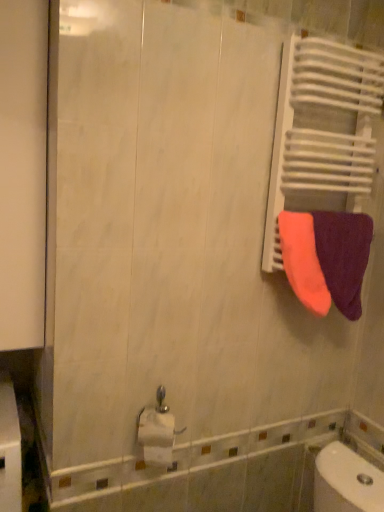
This screenshot has height=512, width=384. Identify the location of orange terry cloth towel at right, which ranks as the 1th towel in right-to-left order. pyautogui.click(x=343, y=256).

From the picture: Measure the distance between point (354, 218) and camera.

They are 4.88 feet apart.

Find the location of a particular element. white glossy toilet paper at lower center is located at coordinates (156, 435).

Looking at this image, is white glossy toilet paper at lower center touching neon orange fabric at right, which is the 1th towel in left-to-right order?

No.

Visually, is white glossy toilet paper at lower center positioned to the left or to the right of neon orange fabric at right, which is the 1th towel in left-to-right order?

From the image, it's evident that white glossy toilet paper at lower center is to the left of neon orange fabric at right, which is the 1th towel in left-to-right order.

Looking at this image, in terms of size, does white glossy toilet paper at lower center appear bigger or smaller than neon orange fabric at right, positioned as the second towel in right-to-left order?

Clearly, white glossy toilet paper at lower center is smaller in size than neon orange fabric at right, positioned as the second towel in right-to-left order.

Does neon orange fabric at right, which is the 1th towel in left-to-right order, have a smaller size compared to white glossy toilet paper at lower center?

No.

From the image's perspective, does neon orange fabric at right, positioned as the second towel in right-to-left order, appear lower than white glossy toilet paper at lower center?

No.

Could you measure the distance between neon orange fabric at right, positioned as the second towel in right-to-left order, and white glossy toilet paper at lower center?

They are 68.12 centimeters apart.

Considering the positions of objects neon orange fabric at right, positioned as the second towel in right-to-left order, and white glossy toilet paper at lower center in the image provided, who is more to the right, neon orange fabric at right, positioned as the second towel in right-to-left order, or white glossy toilet paper at lower center?

neon orange fabric at right, positioned as the second towel in right-to-left order, is more to the right.

Is white glossy toilet paper at lower center positioned beyond the bounds of orange terry cloth towel at right, which ranks as the 2th towel in left-to-right order?

white glossy toilet paper at lower center lies outside orange terry cloth towel at right, which ranks as the 2th towel in left-to-right order,'s area.

From the image's perspective, between white glossy toilet paper at lower center and orange terry cloth towel at right, which ranks as the 1th towel in right-to-left order, who is located below?

white glossy toilet paper at lower center is shown below in the image.

Can you confirm if white glossy toilet paper at lower center is positioned to the right of orange terry cloth towel at right, which ranks as the 2th towel in left-to-right order?

No.

Can you confirm if orange terry cloth towel at right, which ranks as the 1th towel in right-to-left order, is positioned to the left of neon orange fabric at right, positioned as the second towel in right-to-left order?

In fact, orange terry cloth towel at right, which ranks as the 1th towel in right-to-left order, is to the right of neon orange fabric at right, positioned as the second towel in right-to-left order.

From the image's perspective, does orange terry cloth towel at right, which ranks as the 2th towel in left-to-right order, appear lower than neon orange fabric at right, positioned as the second towel in right-to-left order?

Yes.

Which is closer to the camera, (346, 289) or (281, 251)?

Clearly, point (346, 289) is more distant from the camera than point (281, 251).

From the image's perspective, is orange terry cloth towel at right, which ranks as the 2th towel in left-to-right order, under white glossy toilet paper at lower center?

No.

Which of these two, orange terry cloth towel at right, which ranks as the 1th towel in right-to-left order, or white glossy toilet paper at lower center, is bigger?

orange terry cloth towel at right, which ranks as the 1th towel in right-to-left order, is bigger.

Considering the relative sizes of orange terry cloth towel at right, which ranks as the 2th towel in left-to-right order, and white glossy toilet paper at lower center in the image provided, is orange terry cloth towel at right, which ranks as the 2th towel in left-to-right order, shorter than white glossy toilet paper at lower center?

No, orange terry cloth towel at right, which ranks as the 2th towel in left-to-right order, is not shorter than white glossy toilet paper at lower center.

In the image, is orange terry cloth towel at right, which ranks as the 2th towel in left-to-right order, positioned in front of or behind white glossy toilet paper at lower center?

orange terry cloth towel at right, which ranks as the 2th towel in left-to-right order, is behind white glossy toilet paper at lower center.

Is neon orange fabric at right, which is the 1th towel in left-to-right order, wider or thinner than orange terry cloth towel at right, which ranks as the 1th towel in right-to-left order?

Clearly, neon orange fabric at right, which is the 1th towel in left-to-right order, has less width compared to orange terry cloth towel at right, which ranks as the 1th towel in right-to-left order.

From their relative heights in the image, would you say neon orange fabric at right, positioned as the second towel in right-to-left order, is taller or shorter than orange terry cloth towel at right, which ranks as the 2th towel in left-to-right order?

Clearly, neon orange fabric at right, positioned as the second towel in right-to-left order, is shorter compared to orange terry cloth towel at right, which ranks as the 2th towel in left-to-right order.

Is neon orange fabric at right, positioned as the second towel in right-to-left order, not within orange terry cloth towel at right, which ranks as the 2th towel in left-to-right order?

Actually, neon orange fabric at right, positioned as the second towel in right-to-left order, is at least partially inside orange terry cloth towel at right, which ranks as the 2th towel in left-to-right order.

In the scene shown: Does neon orange fabric at right, which is the 1th towel in left-to-right order, have a larger size compared to orange terry cloth towel at right, which ranks as the 1th towel in right-to-left order?

Incorrect, neon orange fabric at right, which is the 1th towel in left-to-right order, is not larger than orange terry cloth towel at right, which ranks as the 1th towel in right-to-left order.

The height and width of the screenshot is (512, 384). Identify the location of the 2nd towel located above the white glossy toilet paper at lower center (from a real-world perspective). (303, 261).

What are the coordinates of `toilet paper to the left of neon orange fabric at right, which is the 1th towel in left-to-right order` in the screenshot? It's located at (156, 435).

Which object lies nearer to the anchor point white glossy toilet paper at lower center, neon orange fabric at right, which is the 1th towel in left-to-right order, or orange terry cloth towel at right, which ranks as the 1th towel in right-to-left order?

neon orange fabric at right, which is the 1th towel in left-to-right order, is positioned closer to the anchor white glossy toilet paper at lower center.

Consider the image. Based on their spatial positions, is white glossy toilet paper at lower center or neon orange fabric at right, positioned as the second towel in right-to-left order, closer to orange terry cloth towel at right, which ranks as the 2th towel in left-to-right order?

Among the two, neon orange fabric at right, positioned as the second towel in right-to-left order, is located nearer to orange terry cloth towel at right, which ranks as the 2th towel in left-to-right order.

When comparing their distances from white glossy toilet paper at lower center, does orange terry cloth towel at right, which ranks as the 1th towel in right-to-left order, or neon orange fabric at right, which is the 1th towel in left-to-right order, seem further?

orange terry cloth towel at right, which ranks as the 1th towel in right-to-left order, lies further to white glossy toilet paper at lower center than the other object.

When comparing their distances from neon orange fabric at right, which is the 1th towel in left-to-right order, does orange terry cloth towel at right, which ranks as the 1th towel in right-to-left order, or white glossy toilet paper at lower center seem further?

white glossy toilet paper at lower center is positioned further to the anchor neon orange fabric at right, which is the 1th towel in left-to-right order.

Based on their spatial positions, is white glossy toilet paper at lower center or orange terry cloth towel at right, which ranks as the 2th towel in left-to-right order, further from neon orange fabric at right, which is the 1th towel in left-to-right order?

Based on the image, white glossy toilet paper at lower center appears to be further to neon orange fabric at right, which is the 1th towel in left-to-right order.

Based on their spatial positions, is neon orange fabric at right, which is the 1th towel in left-to-right order, or white glossy toilet paper at lower center closer to orange terry cloth towel at right, which ranks as the 2th towel in left-to-right order?

neon orange fabric at right, which is the 1th towel in left-to-right order, is closer to orange terry cloth towel at right, which ranks as the 2th towel in left-to-right order.

Find the location of a particular element. The height and width of the screenshot is (512, 384). towel between white glossy toilet paper at lower center and orange terry cloth towel at right, which ranks as the 1th towel in right-to-left order, from left to right is located at coordinates pos(303,261).